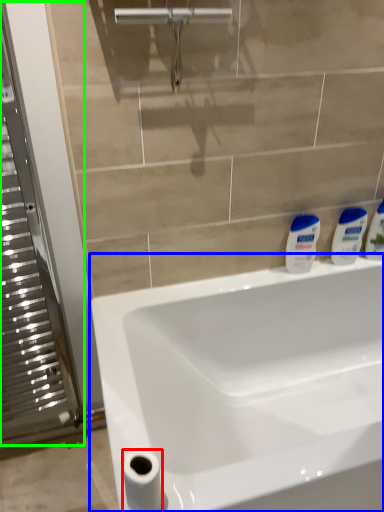
Question: Considering the real-world distances, which object is farthest from toilet paper (highlighted by a red box)? sink (highlighted by a blue box) or screen door (highlighted by a green box)?

Choices:
 (A) sink
 (B) screen door

Answer: (B)